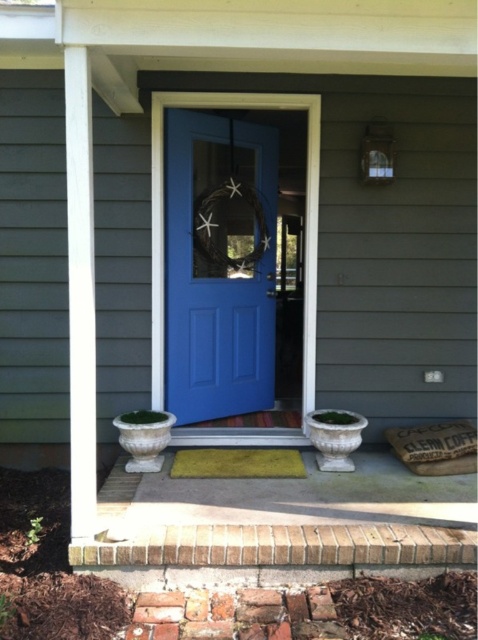
You are a delivery person trying to place a package on the yellow textured mat at center. The package is 2 feet tall. Can the package fit on the mat without touching the matte blue door at center?

The matte blue door at center is much taller than the yellow textured mat at center. The package is 2 feet tall, which is shorter than the door. However, the height of the mat itself isn not specified, so it is unclear if the package will fit without touching the door. Further information is needed.

You are standing at the entrance of the house. There is a point marked at coordinates (218, 266). What object is located at that point?

The point at coordinates (218, 266) marks the location of the matte blue door at center.